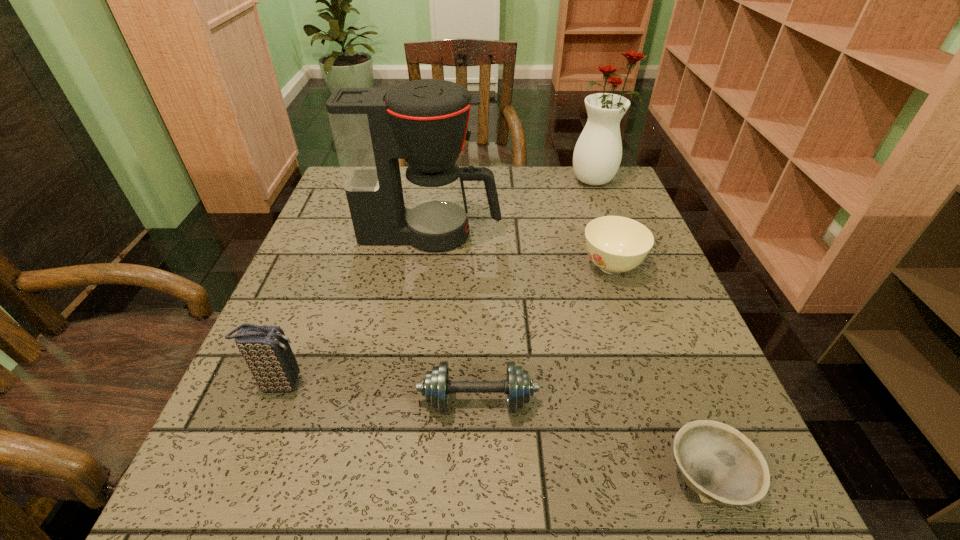
Locate an element on the screen. bowl that is at the right edge is located at coordinates (721, 465).

In order to click on object that is positioned at the far right corner in this screenshot , I will do `click(597, 155)`.

Identify the location of object at the near right corner. (721, 465).

The width and height of the screenshot is (960, 540). I want to click on vacant region at the far edge of the desktop, so click(562, 201).

In the image, there is a desktop. Identify the location of free region at the left edge. The height and width of the screenshot is (540, 960). (324, 347).

The width and height of the screenshot is (960, 540). What are the coordinates of `vacant space at the right edge` in the screenshot? It's located at (639, 369).

Identify the location of vacant space at the far left corner of the desktop. This screenshot has width=960, height=540. (337, 196).

In the image, there is a desktop. At what (x,y) coordinates should I click in order to perform the action: click on vacant space at the far right corner. Please return your answer as a coordinate pair (x, y). This screenshot has height=540, width=960. Looking at the image, I should click on (626, 183).

The width and height of the screenshot is (960, 540). I want to click on vacant area that lies between the bowl and the dumbbell, so click(x=592, y=440).

Where is `free space between the dumbbell and the coffee maker`? free space between the dumbbell and the coffee maker is located at coordinates (454, 318).